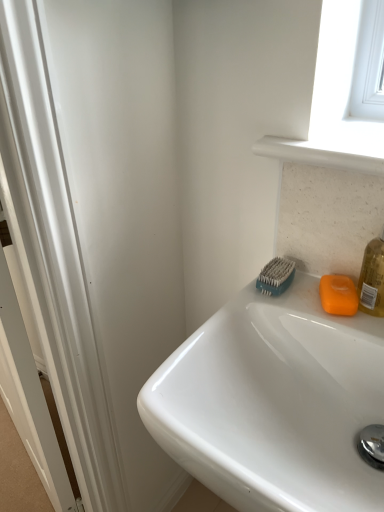
You are a GUI agent. You are given a task and a screenshot of the screen. Output one action in this format:
    pyautogui.click(x=<x>, y=<y>)
    Task: Click on the vacant space in front of teal rubber brush at upper right
    This screenshot has height=512, width=384.
    Given the screenshot: What is the action you would take?
    pyautogui.click(x=284, y=317)